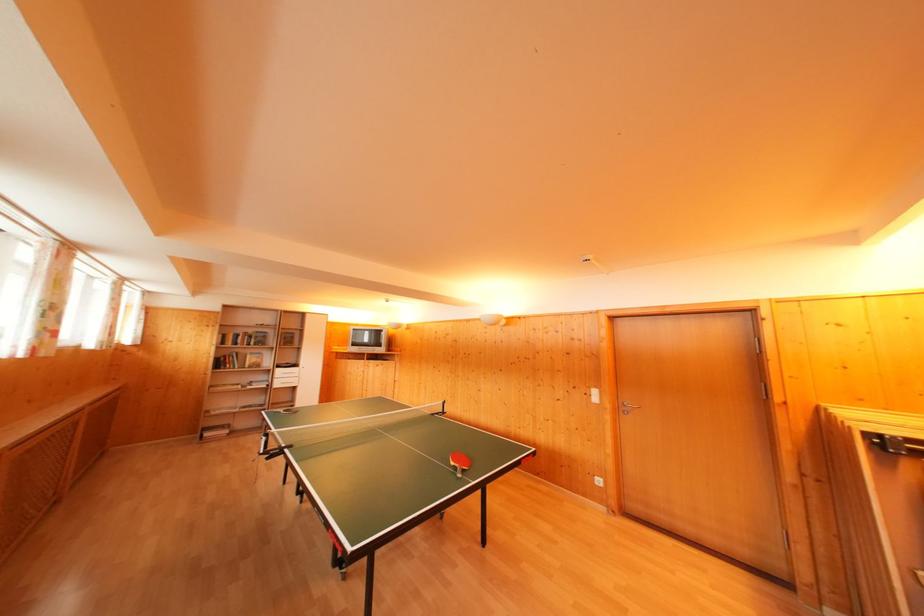
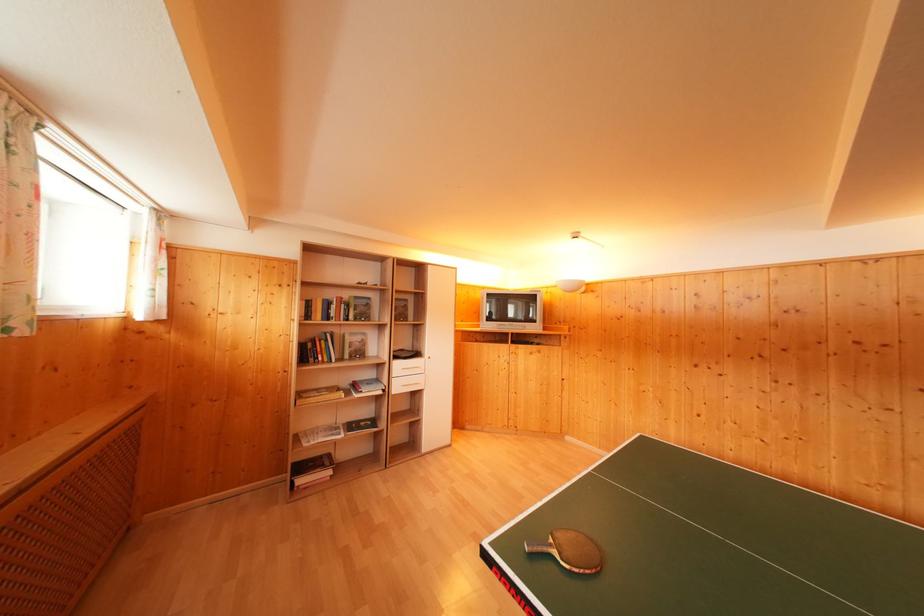
In the second image, find the point that corresponds to (x=268, y=383) in the first image.

(375, 379)